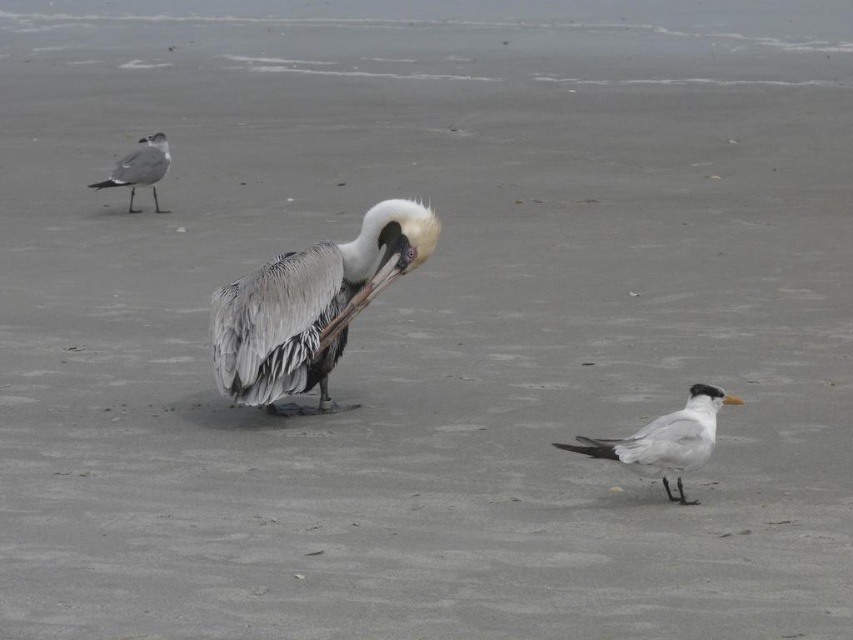
You are a photographer standing on the beach and want to take a photo of the gray feathered pelican at center and the gray matte seagull at upper left. Which bird will appear larger in the photo?

The gray feathered pelican at center will appear larger in the photo because it is closer to the viewer than the gray matte seagull at upper left.

You are standing on the beach and want to take a photo of the gray feathered pelican at center and the gray matte seagull at upper left. Which bird should you zoom in more on to capture both in the frame?

You should zoom in more on the gray matte seagull at upper left because the gray feathered pelican at center is larger and will take up more space in the photo, so adjusting focus on the smaller seagull ensures both fit in the frame.